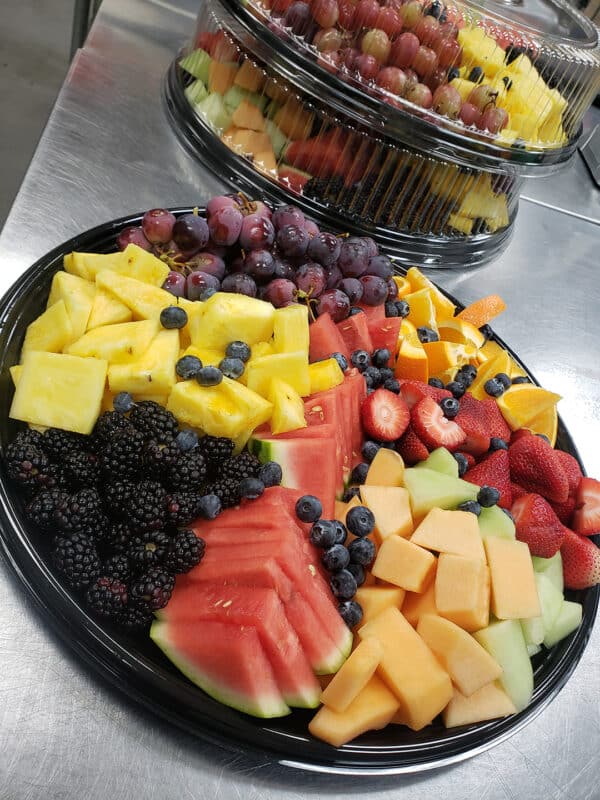
Identify the location of fruit platter. (206, 718), (455, 249), (466, 116).